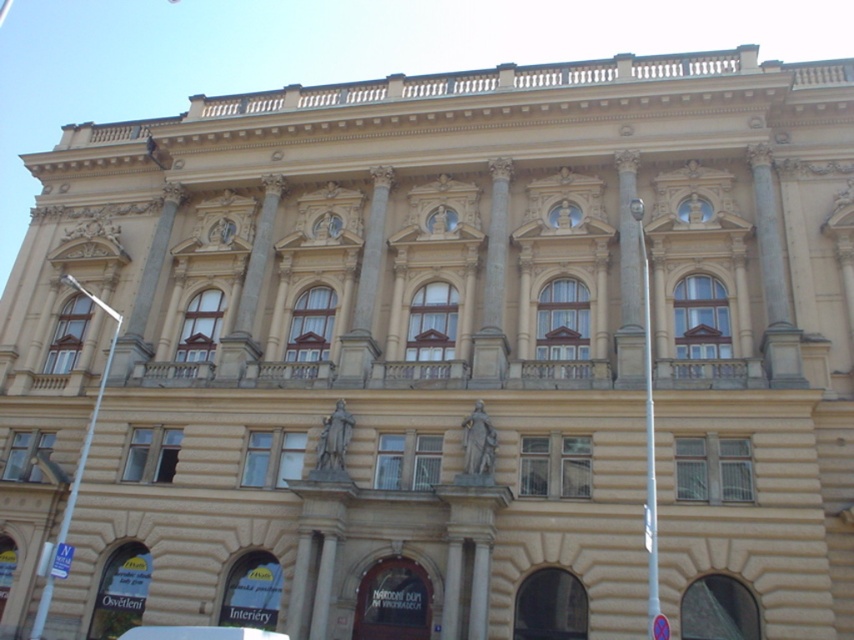
Does white marble pillar at center have a lesser width compared to beige stone column at center?

Indeed, white marble pillar at center has a lesser width compared to beige stone column at center.

Does white marble pillar at center have a smaller size compared to beige stone column at center?

Correct, white marble pillar at center occupies less space than beige stone column at center.

Which is in front, point (478, 580) or point (452, 627)?

Positioned in front is point (452, 627).

Where is `white marble pillar at center`? Image resolution: width=854 pixels, height=640 pixels. white marble pillar at center is located at coordinates (478, 592).

What do you see at coordinates (478, 592) in the screenshot? This screenshot has width=854, height=640. I see `white marble pillar at center` at bounding box center [478, 592].

Is white marble pillar at center taller than beige stone pillar at center?

Yes, white marble pillar at center is taller than beige stone pillar at center.

Identify the location of white marble pillar at center. Image resolution: width=854 pixels, height=640 pixels. (478, 592).

Is point (460, 557) farther from viewer compared to point (330, 577)?

No.

Who is taller, beige stone column at center or beige stone pillar at center?

Standing taller between the two is beige stone column at center.

At what (x,y) coordinates should I click in order to perform the action: click on beige stone column at center. Please return your answer as a coordinate pair (x, y). Looking at the image, I should click on (452, 589).

Locate an element on the screen. The image size is (854, 640). beige stone column at center is located at coordinates (452, 589).